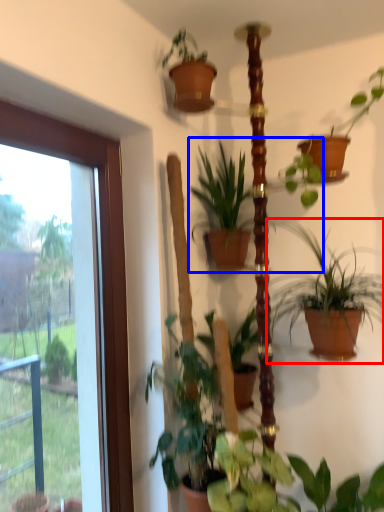
Question: Which of the following is the farthest to the observer, houseplant (highlighted by a red box) or houseplant (highlighted by a blue box)?

Choices:
 (A) houseplant
 (B) houseplant

Answer: (B)